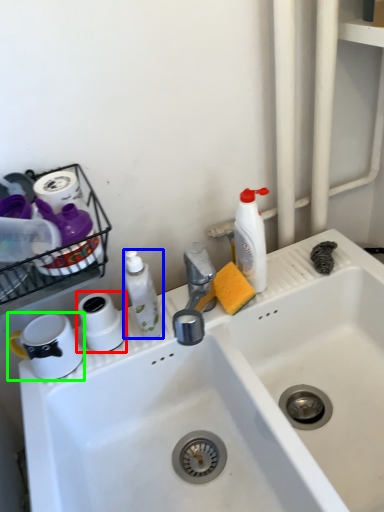
Question: Estimate the real-world distances between objects in this image. Which object is farther from toilet paper (highlighted by a red box), cleaning product (highlighted by a blue box) or appliance (highlighted by a green box)?

Choices:
 (A) cleaning product
 (B) appliance

Answer: (A)